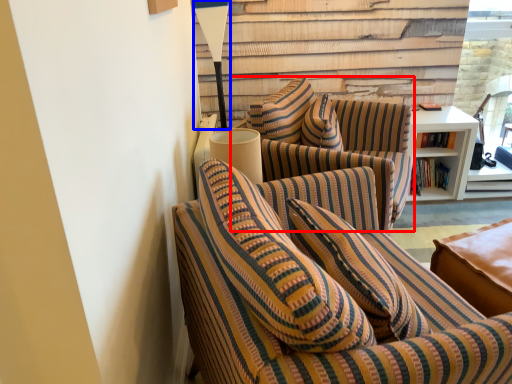
Question: Which object is further to the camera taking this photo, studio couch (highlighted by a red box) or table lamp (highlighted by a blue box)?

Choices:
 (A) studio couch
 (B) table lamp

Answer: (B)